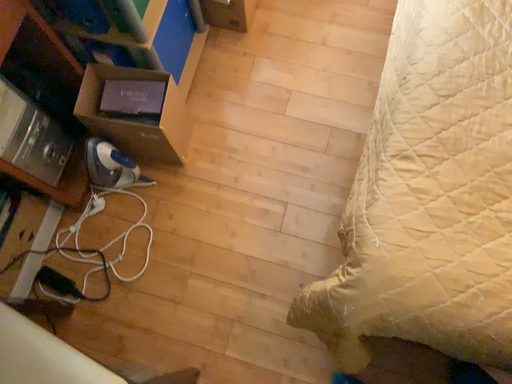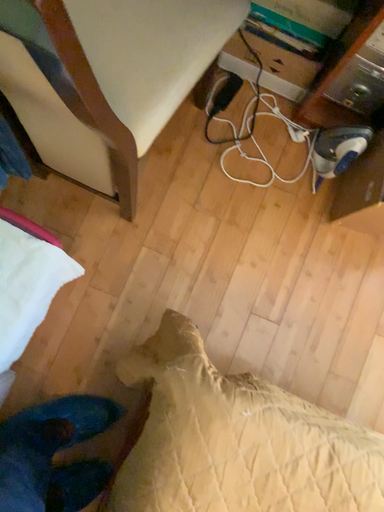
Question: Which way did the camera rotate in the video?

Choices:
 (A) rotated left
 (B) rotated right

Answer: (A)